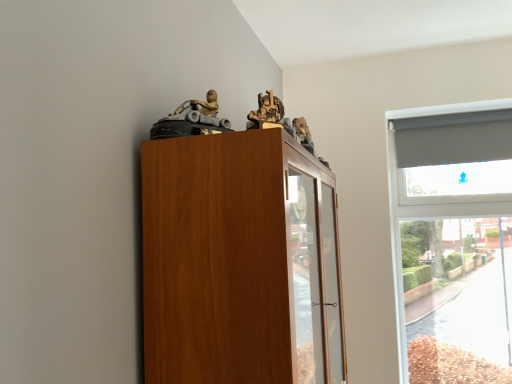
Question: Is wooden cabinet at upper left further to the viewer compared to wooden figure at upper center, the first toy in the right-to-left sequence?

Choices:
 (A) no
 (B) yes

Answer: (A)

Question: Does wooden cabinet at upper left appear on the left side of wooden figure at upper center, the 2th toy viewed from the left?

Choices:
 (A) no
 (B) yes

Answer: (A)

Question: Is wooden cabinet at upper left facing towards wooden figure at upper center, the 2th toy viewed from the left?

Choices:
 (A) no
 (B) yes

Answer: (A)

Question: From a real-world perspective, is wooden cabinet at upper left on wooden figure at upper center, the 2th toy viewed from the left?

Choices:
 (A) no
 (B) yes

Answer: (A)

Question: Is wooden cabinet at upper left thinner than wooden figure at upper center, the 2th toy viewed from the left?

Choices:
 (A) yes
 (B) no

Answer: (B)

Question: Can you confirm if wooden cabinet at upper left is taller than wooden figure at upper center, the 2th toy viewed from the left?

Choices:
 (A) no
 (B) yes

Answer: (B)

Question: Is matte gray plastic toy car at upper center, which is counted as the second toy, starting from the right, taller than wooden cabinet at upper left?

Choices:
 (A) no
 (B) yes

Answer: (A)

Question: Is matte gray plastic toy car at upper center, which ranks as the first toy in left-to-right order, far away from wooden cabinet at upper left?

Choices:
 (A) no
 (B) yes

Answer: (A)

Question: From a real-world perspective, is matte gray plastic toy car at upper center, which ranks as the first toy in left-to-right order, physically above wooden cabinet at upper left?

Choices:
 (A) yes
 (B) no

Answer: (A)

Question: Is wooden cabinet at upper left a part of matte gray plastic toy car at upper center, which is counted as the second toy, starting from the right?

Choices:
 (A) yes
 (B) no

Answer: (B)

Question: Does matte gray plastic toy car at upper center, which is counted as the second toy, starting from the right, have a lesser width compared to wooden cabinet at upper left?

Choices:
 (A) no
 (B) yes

Answer: (B)

Question: Is matte gray plastic toy car at upper center, which ranks as the first toy in left-to-right order, completely or partially outside of wooden cabinet at upper left?

Choices:
 (A) no
 (B) yes

Answer: (B)

Question: Is wooden figure at upper center, the first toy in the right-to-left sequence, in front of matte gray plastic toy car at upper center, which ranks as the first toy in left-to-right order?

Choices:
 (A) no
 (B) yes

Answer: (A)